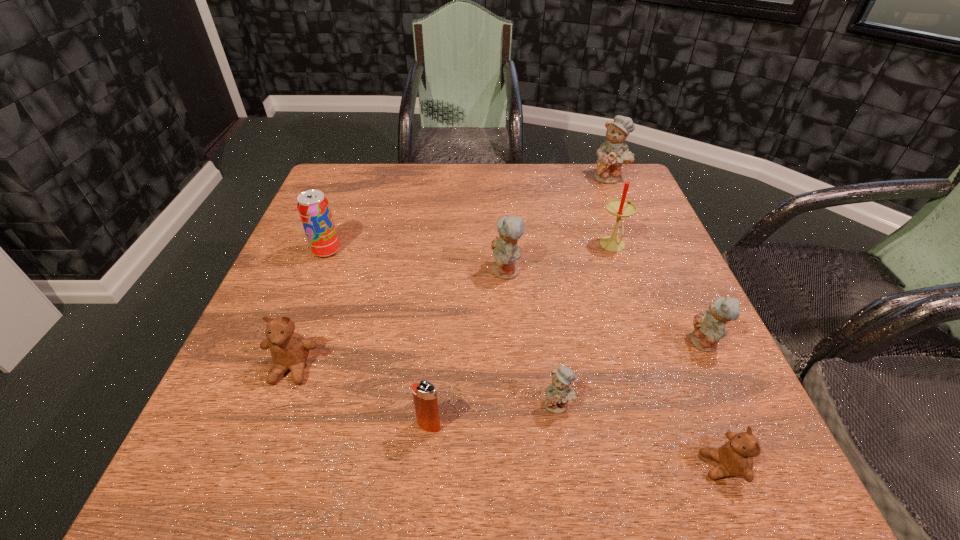
You are a GUI agent. You are given a task and a screenshot of the screen. Output one action in this format:
    pyautogui.click(x=<x>, y=<y>)
    Task: Click on the vacant space that satisfies the following two spatial constraints: 1. on the front-facing side of the tallest teddy bear; 2. on the face of the right brown teddy bear
    This screenshot has height=540, width=960.
    Given the screenshot: What is the action you would take?
    pyautogui.click(x=729, y=466)

Where is `vacant area that satisfies the following two spatial constraints: 1. on the front-facing side of the tallest teddy bear; 2. on the front-facing side of the third smallest blue teddy bear`? The image size is (960, 540). vacant area that satisfies the following two spatial constraints: 1. on the front-facing side of the tallest teddy bear; 2. on the front-facing side of the third smallest blue teddy bear is located at coordinates (649, 272).